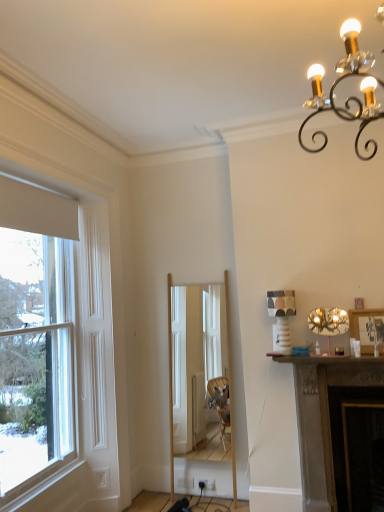
This screenshot has height=512, width=384. Identify the location of white wood window at left. (58, 366).

This screenshot has height=512, width=384. Find the location of `wooden framed picture at right`. wooden framed picture at right is located at coordinates (367, 328).

What do you see at coordinates (196, 359) in the screenshot? I see `natural wood mirror at center` at bounding box center [196, 359].

What is the approximate height of metallic gold chandelier at upper right?

metallic gold chandelier at upper right is 13.73 inches in height.

The width and height of the screenshot is (384, 512). What do you see at coordinates (324, 417) in the screenshot?
I see `dark brown stone fireplace at lower right` at bounding box center [324, 417].

The image size is (384, 512). I want to click on white wood window at left, so click(x=58, y=366).

Considering the sizes of objects natural wood mirror at center and metallic gold chandelier at upper right in the image provided, who is wider, natural wood mirror at center or metallic gold chandelier at upper right?

natural wood mirror at center is wider.

How far apart are natural wood mirror at center and metallic gold chandelier at upper right?

natural wood mirror at center is 1.04 meters away from metallic gold chandelier at upper right.

Which object is closer to the camera taking this photo, natural wood mirror at center or metallic gold chandelier at upper right?

metallic gold chandelier at upper right is closer to the camera.

Is natural wood mirror at center facing towards metallic gold chandelier at upper right?

No, natural wood mirror at center is not facing towards metallic gold chandelier at upper right.

Considering the relative positions of metallic gold chandelier at upper right and wooden framed picture at right in the image provided, is metallic gold chandelier at upper right to the right of wooden framed picture at right from the viewer's perspective?

Incorrect, metallic gold chandelier at upper right is not on the right side of wooden framed picture at right.

Locate an element on the screen. This screenshot has height=512, width=384. lamp below the wooden framed picture at right (from the image's perspective) is located at coordinates (328, 322).

Is metallic gold chandelier at upper right turned away from wooden framed picture at right?

metallic gold chandelier at upper right is not turned away from wooden framed picture at right.

In terms of height, does metallic gold chandelier at upper right look taller or shorter compared to wooden framed picture at right?

metallic gold chandelier at upper right is shorter than wooden framed picture at right.

Based on the photo, does metallic gold chandelier at upper right have a lesser height compared to white wood window at left?

Yes, metallic gold chandelier at upper right is shorter than white wood window at left.

Locate an element on the screen. lamp located above the white wood window at left (from the image's perspective) is located at coordinates (328, 322).

Is metallic gold chandelier at upper right beside white wood window at left?

No, metallic gold chandelier at upper right is not beside white wood window at left.

Is dark brown stone fireplace at lower right beside metallic gold chandelier at upper right?

No, dark brown stone fireplace at lower right is not in contact with metallic gold chandelier at upper right.

In the scene shown: Between dark brown stone fireplace at lower right and metallic gold chandelier at upper right, which one has larger size?

dark brown stone fireplace at lower right.

In terms of height, does dark brown stone fireplace at lower right look taller or shorter compared to metallic gold chandelier at upper right?

In the image, dark brown stone fireplace at lower right appears to be taller than metallic gold chandelier at upper right.

Is dark brown stone fireplace at lower right at the left side of metallic gold chandelier at upper right?

Incorrect, dark brown stone fireplace at lower right is not on the left side of metallic gold chandelier at upper right.

Is dark brown stone fireplace at lower right surrounding natural wood mirror at center?

No, natural wood mirror at center is located outside of dark brown stone fireplace at lower right.

Is dark brown stone fireplace at lower right smaller than natural wood mirror at center?

Incorrect, dark brown stone fireplace at lower right is not smaller in size than natural wood mirror at center.

From a real-world perspective, is dark brown stone fireplace at lower right positioned above or below natural wood mirror at center?

From a real-world perspective, dark brown stone fireplace at lower right is physically below natural wood mirror at center.

Considering the positions of point (332, 481) and point (180, 409), is point (332, 481) closer or farther from the camera than point (180, 409)?

Point (332, 481) is positioned closer to the camera compared to point (180, 409).

At what (x,y) coordinates should I click in order to perform the action: click on fireplace lying behind the metallic gold chandelier at upper right. Please return your answer as a coordinate pair (x, y). Looking at the image, I should click on (324, 417).

Considering the sizes of metallic gold chandelier at upper right and dark brown stone fireplace at lower right in the image, is metallic gold chandelier at upper right taller or shorter than dark brown stone fireplace at lower right?

Clearly, metallic gold chandelier at upper right is shorter compared to dark brown stone fireplace at lower right.

Consider the image. Does metallic gold chandelier at upper right have a greater width compared to dark brown stone fireplace at lower right?

Correct, the width of metallic gold chandelier at upper right exceeds that of dark brown stone fireplace at lower right.

Is metallic gold chandelier at upper right positioned in front of dark brown stone fireplace at lower right?

Yes, metallic gold chandelier at upper right is in front of dark brown stone fireplace at lower right.

Based on the photo, does metallic gold chandelier at upper right have a lesser width compared to metallic gold chandelier at upper right?

In fact, metallic gold chandelier at upper right might be wider than metallic gold chandelier at upper right.

Which point is more distant from viewer, (x=364, y=61) or (x=334, y=322)?

Point (x=334, y=322)

How much distance is there between metallic gold chandelier at upper right and metallic gold chandelier at upper right?

The distance of metallic gold chandelier at upper right from metallic gold chandelier at upper right is 5.50 feet.

The image size is (384, 512). What are the coordinates of `light fixture above the metallic gold chandelier at upper right (from the image's perspective)` in the screenshot? It's located at (350, 96).

Identify the location of mirror that appears below the metallic gold chandelier at upper right (from a real-world perspective). Image resolution: width=384 pixels, height=512 pixels. (196, 359).

I want to click on picture frame above the metallic gold chandelier at upper right (from the image's perspective), so [x=367, y=328].

When comparing their distances from metallic gold chandelier at upper right, does metallic gold chandelier at upper right or white wood window at left seem closer?

Among the two, metallic gold chandelier at upper right is located nearer to metallic gold chandelier at upper right.

Estimate the real-world distances between objects in this image. Which object is closer to white wood window at left, natural wood mirror at center or dark brown stone fireplace at lower right?

natural wood mirror at center is positioned closer to the anchor white wood window at left.

Estimate the real-world distances between objects in this image. Which object is further from metallic gold chandelier at upper right, metallic gold chandelier at upper right or white wood window at left?

white wood window at left lies further to metallic gold chandelier at upper right than the other object.

Which object lies further to the anchor point natural wood mirror at center, white wood window at left or metallic gold chandelier at upper right?

Among the two, metallic gold chandelier at upper right is located further to natural wood mirror at center.

Which object lies further to the anchor point white wood window at left, metallic gold chandelier at upper right or natural wood mirror at center?

The object further to white wood window at left is metallic gold chandelier at upper right.

From the image, which object appears to be farther from metallic gold chandelier at upper right, white wood window at left or metallic gold chandelier at upper right?

Based on the image, white wood window at left appears to be further to metallic gold chandelier at upper right.

From the image, which object appears to be farther from wooden framed picture at right, white wood window at left or metallic gold chandelier at upper right?

Based on the image, white wood window at left appears to be further to wooden framed picture at right.

Which object lies further to the anchor point metallic gold chandelier at upper right, white wood window at left or dark brown stone fireplace at lower right?

Based on the image, white wood window at left appears to be further to metallic gold chandelier at upper right.

This screenshot has width=384, height=512. Identify the location of lamp situated between natural wood mirror at center and wooden framed picture at right from left to right. (x=328, y=322).

Find the location of a particular element. The width and height of the screenshot is (384, 512). window located between metallic gold chandelier at upper right and wooden framed picture at right in the depth direction is located at coordinates (58, 366).

This screenshot has height=512, width=384. I want to click on lamp between natural wood mirror at center and dark brown stone fireplace at lower right, so click(328, 322).

Locate an element on the screen. This screenshot has height=512, width=384. lamp that lies between wooden framed picture at right and dark brown stone fireplace at lower right from top to bottom is located at coordinates (328, 322).